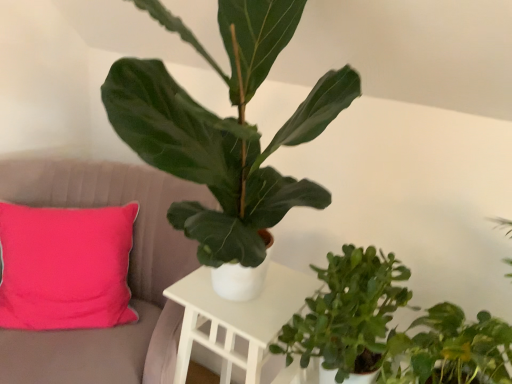
Question: Is green matte plant at center, positioned as the third houseplant in bottom-to-top order, closer to the viewer compared to green matte plant at lower right, which is counted as the 3th houseplant, starting from the top?

Choices:
 (A) yes
 (B) no

Answer: (A)

Question: From a real-world perspective, is green matte plant at center, positioned as the third houseplant in bottom-to-top order, physically below green matte plant at lower right, which is counted as the 3th houseplant, starting from the top?

Choices:
 (A) yes
 (B) no

Answer: (B)

Question: Considering the relative positions of green matte plant at center, positioned as the third houseplant in bottom-to-top order, and green matte plant at lower right, the 1th houseplant when ordered from bottom to top, in the image provided, is green matte plant at center, positioned as the third houseplant in bottom-to-top order, behind green matte plant at lower right, the 1th houseplant when ordered from bottom to top,?

Choices:
 (A) no
 (B) yes

Answer: (A)

Question: Is green matte plant at center, the 1th houseplant from the top, oriented towards green matte plant at lower right, the 1th houseplant when ordered from bottom to top?

Choices:
 (A) no
 (B) yes

Answer: (A)

Question: Is green matte plant at center, the 1th houseplant from the top, looking in the opposite direction of green matte plant at lower right, the 1th houseplant when ordered from bottom to top?

Choices:
 (A) no
 (B) yes

Answer: (A)

Question: Would you say green matte plant at center, the 1th houseplant from the top, is to the left or to the right of pink fabric cushion at left in the picture?

Choices:
 (A) right
 (B) left

Answer: (A)

Question: Is green matte plant at center, the 1th houseplant from the top, in front of or behind pink fabric cushion at left in the image?

Choices:
 (A) behind
 (B) front

Answer: (B)

Question: Is point (250, 66) closer or farther from the camera than point (56, 370)?

Choices:
 (A) farther
 (B) closer

Answer: (B)

Question: Looking at the image, does green matte plant at center, positioned as the third houseplant in bottom-to-top order, seem bigger or smaller compared to pink fabric cushion at left?

Choices:
 (A) big
 (B) small

Answer: (B)

Question: Is green matte plant at lower right, which is counted as the 3th houseplant, starting from the top, inside or outside of green matte plant at center, positioned as the third houseplant in bottom-to-top order?

Choices:
 (A) outside
 (B) inside

Answer: (A)

Question: From a real-world perspective, is green matte plant at lower right, which is counted as the 3th houseplant, starting from the top, above or below green matte plant at center, the 1th houseplant from the top?

Choices:
 (A) below
 (B) above

Answer: (A)

Question: Is green matte plant at lower right, the 1th houseplant when ordered from bottom to top, wider or thinner than green matte plant at center, the 1th houseplant from the top?

Choices:
 (A) wide
 (B) thin

Answer: (B)

Question: From the image's perspective, is green matte plant at lower right, which is counted as the 3th houseplant, starting from the top, positioned above or below green matte plant at center, positioned as the third houseplant in bottom-to-top order?

Choices:
 (A) below
 (B) above

Answer: (A)

Question: Considering their positions, is pink fabric cushion at left located in front of or behind white matte table at center?

Choices:
 (A) front
 (B) behind

Answer: (A)

Question: Is pink fabric cushion at left taller or shorter than white matte table at center?

Choices:
 (A) tall
 (B) short

Answer: (A)